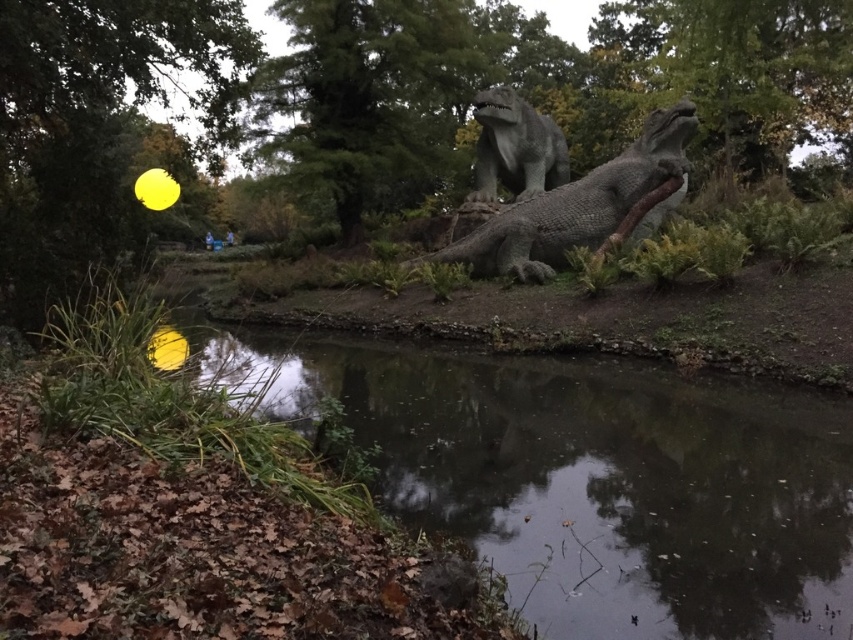
You are a visitor at a garden and want to take a photo of both the gray stone dinosaur at center and the gray textured statue at center. Since you have a camera with a fixed focal length, you need to know which one is taller to adjust the framing. Can you tell me which one is taller?

The gray stone dinosaur at center is taller than the gray textured statue at center, so you should frame the photo to accommodate its height.

You are standing at the edge of the pond in the scene. There is a point marked at coordinates (587, 477) which is in the water. If you want to reach that point without getting your feet wet, which direction should you move relative to your current position?

The point marked at (587, 477) is located in the dark reflective water at center. To reach it without getting your feet wet, you should move towards the center of the pond where the water is located.

You are a visitor at this outdoor park and want to take a photo of both the gray stone dinosaur at center and the gray textured statue at center. Since you have a limited zoom range, you need to know their vertical positions. Which one is lower in the image?

The gray stone dinosaur at center is below the gray textured statue at center, so the gray stone dinosaur at center is lower and the gray textured statue at center is higher in the image.